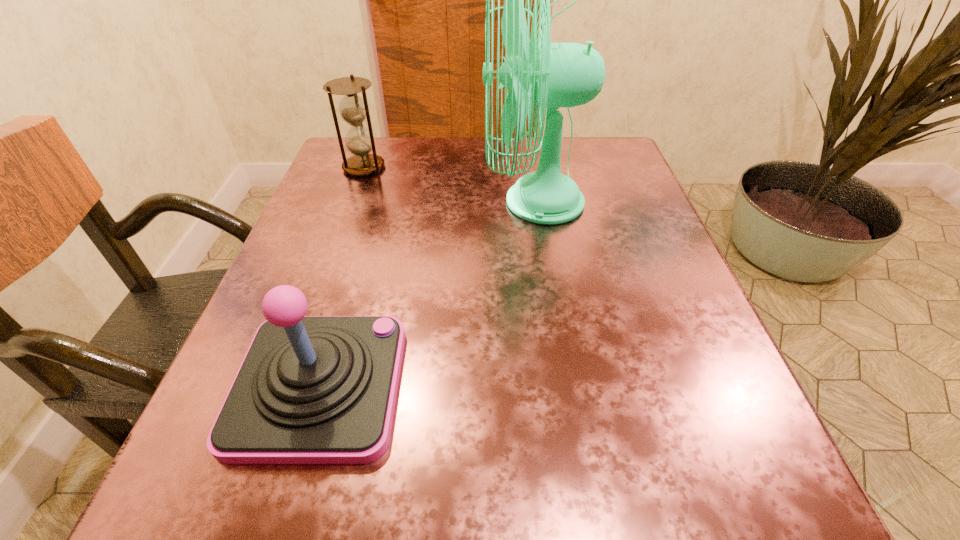
Locate an element on the screen. The width and height of the screenshot is (960, 540). hourglass located at the far edge is located at coordinates (354, 110).

Identify the location of object situated at the near edge. (311, 389).

Identify the location of hourglass present at the left edge. (354, 110).

I want to click on joystick that is at the left edge, so click(311, 389).

The image size is (960, 540). I want to click on object situated at the right edge, so click(551, 75).

Find the location of a particular element. Image resolution: width=960 pixels, height=540 pixels. object located in the far left corner section of the desktop is located at coordinates (354, 110).

The width and height of the screenshot is (960, 540). In order to click on object located at the near left corner in this screenshot , I will do `click(311, 389)`.

Locate an element on the screen. The image size is (960, 540). object located in the far right corner section of the desktop is located at coordinates (551, 75).

Where is `free space at the far edge`? The image size is (960, 540). free space at the far edge is located at coordinates (x=516, y=171).

Locate an element on the screen. The image size is (960, 540). vacant space at the near edge of the desktop is located at coordinates (599, 470).